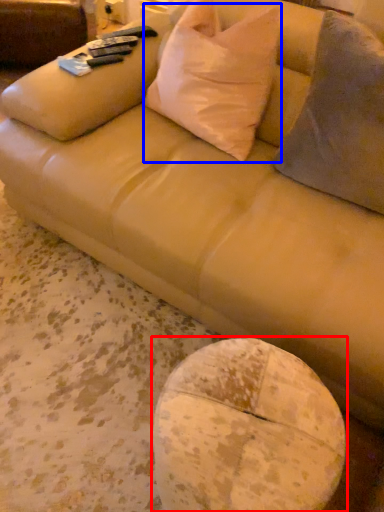
Question: Which object is closer to the camera taking this photo, round table (highlighted by a red box) or throw pillow (highlighted by a blue box)?

Choices:
 (A) round table
 (B) throw pillow

Answer: (A)